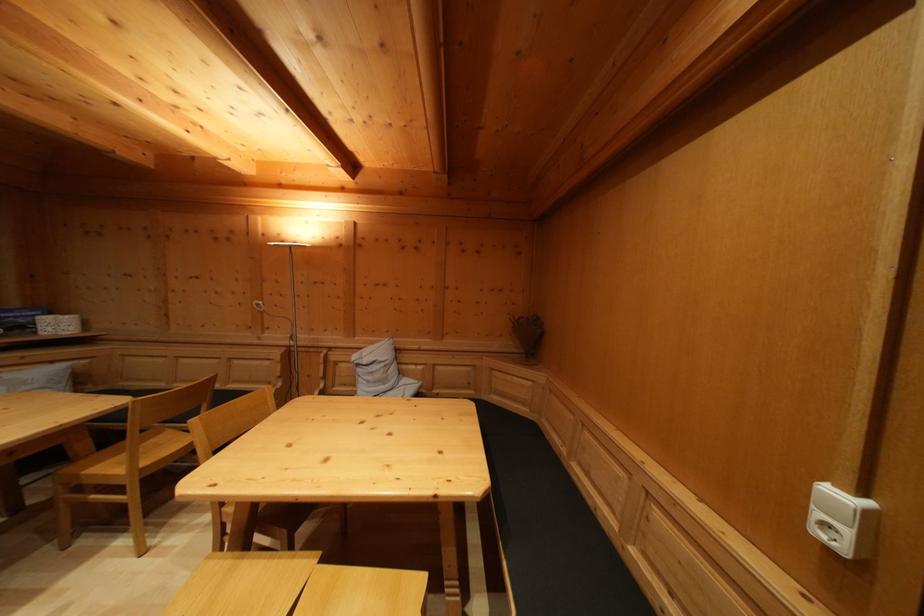
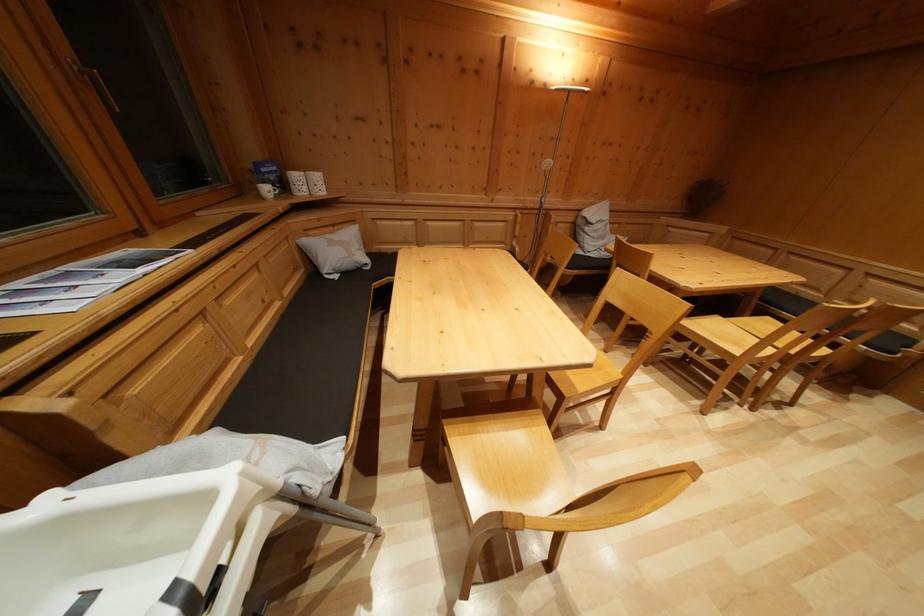
In the second image, find the point that corresponds to the point at 58,369 in the first image.

(338, 233)